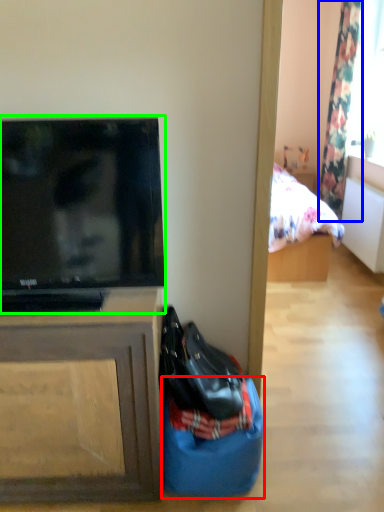
Question: Based on their relative distances, which object is farther from sack (highlighted by a red box)? Choose from curtain (highlighted by a blue box) and television (highlighted by a green box).

Choices:
 (A) curtain
 (B) television

Answer: (A)